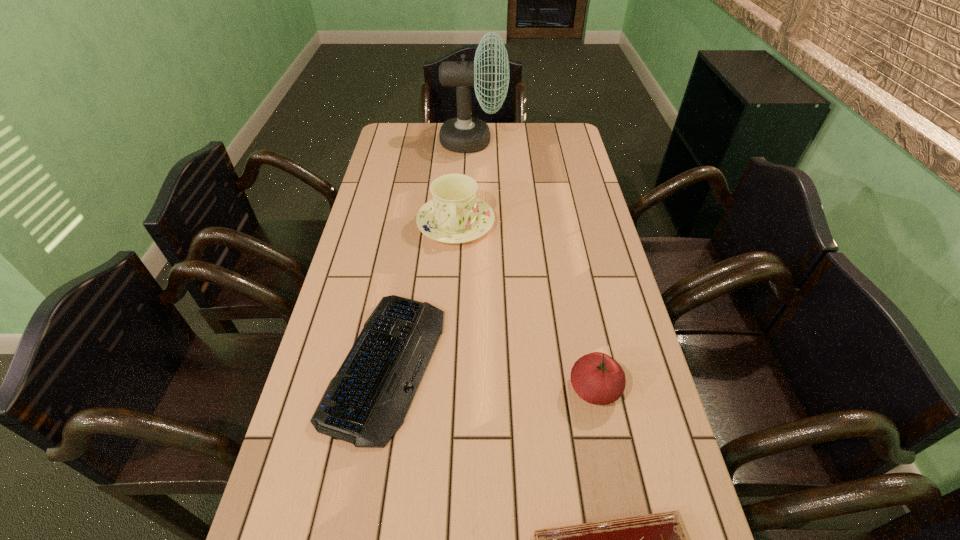
Where is `free space between the computer keyboard and the fourth nearest object`? This screenshot has width=960, height=540. free space between the computer keyboard and the fourth nearest object is located at coordinates (420, 294).

Where is `free space between the tomato and the second tallest object`? free space between the tomato and the second tallest object is located at coordinates (525, 306).

In order to click on vacant space in between the second shortest object and the fan in this screenshot , I will do `click(429, 253)`.

Locate an element on the screen. free spot between the fan and the fourth tallest object is located at coordinates [x=429, y=253].

Identify the location of object that stands as the third closest to the farthest object. (597, 378).

Identify the location of object that is the third closest to the second farthest object. (597, 378).

At what (x,y) coordinates should I click in order to perform the action: click on blank space that satisfies the following two spatial constraints: 1. in front of the tallest object where the airflow is directed; 2. on the handle side of the fourth shortest object. Please return your answer as a coordinate pair (x, y). The width and height of the screenshot is (960, 540). Looking at the image, I should click on (471, 224).

Find the location of a particular element. This screenshot has height=540, width=960. vacant space that satisfies the following two spatial constraints: 1. on the handle side of the third shortest object; 2. on the right side of the chinaware is located at coordinates (445, 389).

This screenshot has width=960, height=540. Identify the location of free spot that satisfies the following two spatial constraints: 1. in front of the third shortest object where the airflow is directed; 2. on the right side of the fan. pos(468,389).